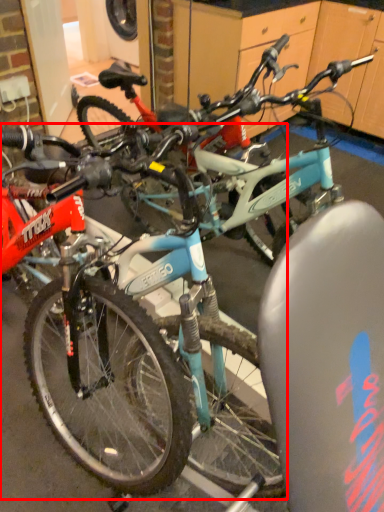
Question: Observing the image, what is the correct spatial positioning of bicycle (annotated by the red box) in reference to bicycle?

Choices:
 (A) left
 (B) right

Answer: (B)